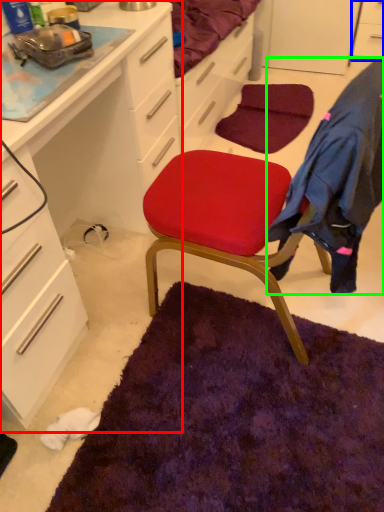
Question: Estimate the real-world distances between objects in this image. Which object is farther from cabinetry (highlighted by a red box), cabinetry (highlighted by a blue box) or clothing (highlighted by a green box)?

Choices:
 (A) cabinetry
 (B) clothing

Answer: (A)